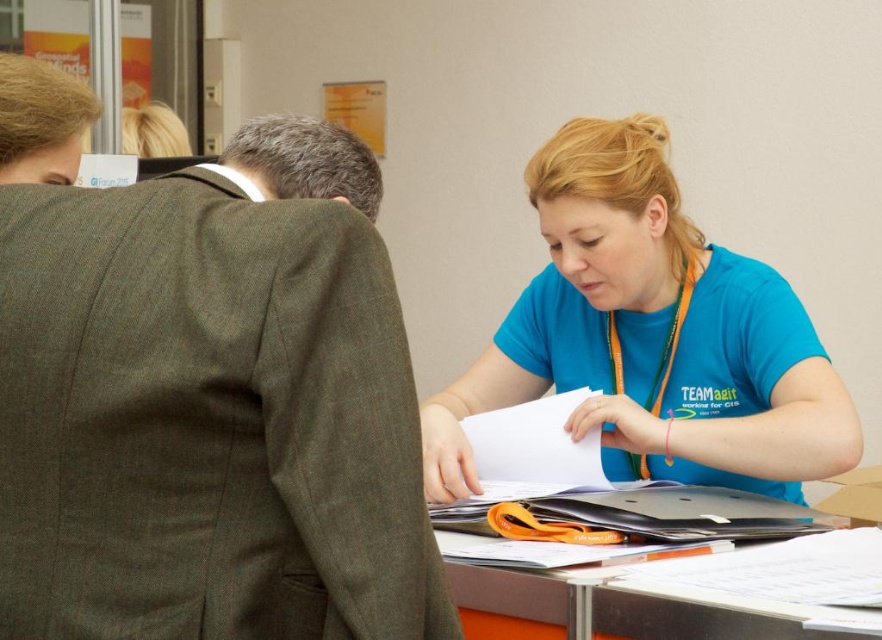
Question: Which object is closer to the camera taking this photo?

Choices:
 (A) blue t-shirt at center
 (B) metallic gray table at center

Answer: (B)

Question: Is blue t-shirt at center positioned in front of metallic gray table at center?

Choices:
 (A) yes
 (B) no

Answer: (B)

Question: Which point is closer to the camera?

Choices:
 (A) (476, 593)
 (B) (535, 380)

Answer: (A)

Question: Can you confirm if blue t-shirt at center is smaller than metallic gray table at center?

Choices:
 (A) yes
 (B) no

Answer: (B)

Question: Can you confirm if blue t-shirt at center is smaller than metallic gray table at center?

Choices:
 (A) yes
 (B) no

Answer: (B)